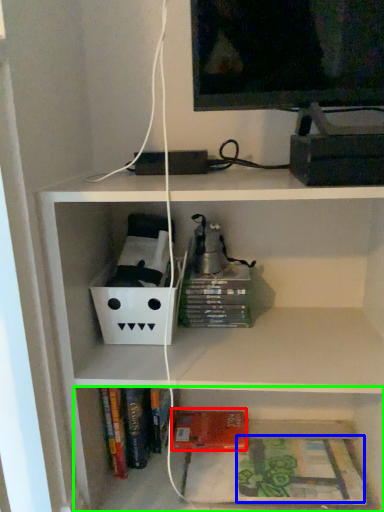
Question: Which is nearer to the paperback book (highlighted by a red box)? book (highlighted by a blue box) or shelf (highlighted by a green box).

Choices:
 (A) book
 (B) shelf

Answer: (B)